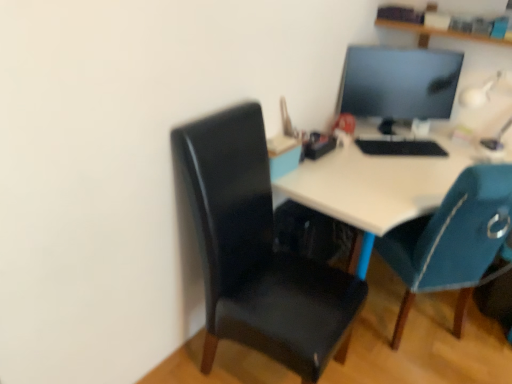
Describe the element at coordinates (258, 253) in the screenshot. I see `glossy black chair at center-left, which is the 2th chair in right-to-left order` at that location.

The width and height of the screenshot is (512, 384). Describe the element at coordinates (452, 240) in the screenshot. I see `teal fabric chair at right, which is the second chair in left-to-right order` at that location.

Locate an element on the screen. The height and width of the screenshot is (384, 512). wooden shelf at upper center is located at coordinates (435, 32).

The image size is (512, 384). I want to click on white glossy desk at center, so (x=379, y=183).

From a real-world perspective, who is located lower, teal fabric chair at right, which is counted as the first chair, starting from the right, or wooden shelf at upper center?

From a 3D spatial view, teal fabric chair at right, which is counted as the first chair, starting from the right, is below.

Would you say teal fabric chair at right, which is the second chair in left-to-right order, is inside or outside wooden shelf at upper center?

teal fabric chair at right, which is the second chair in left-to-right order, exists outside the volume of wooden shelf at upper center.

Looking at this image, is teal fabric chair at right, which is counted as the first chair, starting from the right, placed right next to wooden shelf at upper center?

No, teal fabric chair at right, which is counted as the first chair, starting from the right, is not touching wooden shelf at upper center.

How much distance is there between teal fabric chair at right, which is the second chair in left-to-right order, and wooden shelf at upper center?

teal fabric chair at right, which is the second chair in left-to-right order, is 1.08 meters from wooden shelf at upper center.

Based on the photo, could you measure the distance between teal fabric chair at right, which is counted as the first chair, starting from the right, and white glossy table lamp at upper right?

33.06 inches.

Who is taller, teal fabric chair at right, which is counted as the first chair, starting from the right, or white glossy table lamp at upper right?

With more height is teal fabric chair at right, which is counted as the first chair, starting from the right.

Does teal fabric chair at right, which is counted as the first chair, starting from the right, appear on the right side of white glossy table lamp at upper right?

No.

Locate an element on the screen. table lamp located above the teal fabric chair at right, which is the second chair in left-to-right order (from the image's perspective) is located at coordinates (485, 90).

What are the coordinates of `desk that appears on the right of matte black monitor at upper right` in the screenshot? It's located at (379, 183).

Is white glossy desk at center taller or shorter than matte black monitor at upper right?

In the image, white glossy desk at center appears to be taller than matte black monitor at upper right.

Can you confirm if white glossy desk at center is positioned to the left of matte black monitor at upper right?

No, white glossy desk at center is not to the left of matte black monitor at upper right.

Between white glossy desk at center and matte black monitor at upper right, which one has smaller width?

matte black monitor at upper right.

From the image's perspective, which is below, matte black monitor at upper right or white glossy table lamp at upper right?

white glossy table lamp at upper right, from the image's perspective.

Is matte black monitor at upper right positioned far away from white glossy table lamp at upper right?

No, matte black monitor at upper right is not far from white glossy table lamp at upper right.

Which of these two, matte black monitor at upper right or white glossy table lamp at upper right, stands shorter?

Standing shorter between the two is white glossy table lamp at upper right.

Considering the sizes of objects matte black monitor at upper right and white glossy table lamp at upper right in the image provided, who is thinner, matte black monitor at upper right or white glossy table lamp at upper right?

With smaller width is matte black monitor at upper right.

From a real-world perspective, which object rests below the other?

white glossy table lamp at upper right.

Where is `shelf located in front of the white glossy table lamp at upper right`? Image resolution: width=512 pixels, height=384 pixels. shelf located in front of the white glossy table lamp at upper right is located at coordinates (435, 32).

Is wooden shelf at upper center placed right next to white glossy table lamp at upper right?

wooden shelf at upper center and white glossy table lamp at upper right are clearly separated.

Is point (418, 27) farther from camera compared to point (498, 146)?

That is False.

In terms of size, does white glossy table lamp at upper right appear bigger or smaller than white glossy desk at center?

In the image, white glossy table lamp at upper right appears to be smaller than white glossy desk at center.

In the image, is white glossy table lamp at upper right on the left side or the right side of white glossy desk at center?

Clearly, white glossy table lamp at upper right is on the right of white glossy desk at center in the image.

Is white glossy table lamp at upper right next to white glossy desk at center and touching it?

No, white glossy table lamp at upper right is not touching white glossy desk at center.

Where is `desk above the glossy black chair at center-left, the first chair viewed from the left (from the image's perspective)`? This screenshot has height=384, width=512. desk above the glossy black chair at center-left, the first chair viewed from the left (from the image's perspective) is located at coordinates (379, 183).

From a real-world perspective, relative to glossy black chair at center-left, which is the 2th chair in right-to-left order, is white glossy desk at center vertically above or below?

white glossy desk at center is below glossy black chair at center-left, which is the 2th chair in right-to-left order.

Who is more distant, white glossy desk at center or glossy black chair at center-left, which is the 2th chair in right-to-left order?

Positioned behind is white glossy desk at center.

Is white glossy desk at center aimed at glossy black chair at center-left, which is the 2th chair in right-to-left order?

No.

Locate an element on the screen. This screenshot has width=512, height=384. shelf above the teal fabric chair at right, which is counted as the first chair, starting from the right (from a real-world perspective) is located at coordinates (435, 32).

Which chair is the 1st one when counting from the front of the white glossy table lamp at upper right? Please provide its 2D coordinates.

[(452, 240)]

Looking at the image, which one is located further to white glossy desk at center, glossy black chair at center-left, which is the 2th chair in right-to-left order, or white glossy table lamp at upper right?

white glossy table lamp at upper right lies further to white glossy desk at center than the other object.

From the image, which object appears to be farther from matte black monitor at upper right, white glossy desk at center or teal fabric chair at right, which is counted as the first chair, starting from the right?

The object further to matte black monitor at upper right is teal fabric chair at right, which is counted as the first chair, starting from the right.

From the image, which object appears to be farther from wooden shelf at upper center, white glossy table lamp at upper right or teal fabric chair at right, which is the second chair in left-to-right order?

teal fabric chair at right, which is the second chair in left-to-right order.

Based on their spatial positions, is white glossy table lamp at upper right or glossy black chair at center-left, which is the 2th chair in right-to-left order, further from wooden shelf at upper center?

Among the two, glossy black chair at center-left, which is the 2th chair in right-to-left order, is located further to wooden shelf at upper center.

Estimate the real-world distances between objects in this image. Which object is further from white glossy desk at center, teal fabric chair at right, which is the second chair in left-to-right order, or matte black monitor at upper right?

matte black monitor at upper right lies further to white glossy desk at center than the other object.

When comparing their distances from wooden shelf at upper center, does teal fabric chair at right, which is the second chair in left-to-right order, or glossy black chair at center-left, the first chair viewed from the left, seem further?

glossy black chair at center-left, the first chair viewed from the left, lies further to wooden shelf at upper center than the other object.

Looking at the image, which one is located closer to matte black monitor at upper right, white glossy table lamp at upper right or glossy black chair at center-left, which is the 2th chair in right-to-left order?

white glossy table lamp at upper right lies closer to matte black monitor at upper right than the other object.

When comparing their distances from matte black monitor at upper right, does white glossy desk at center or glossy black chair at center-left, which is the 2th chair in right-to-left order, seem further?

Among the two, glossy black chair at center-left, which is the 2th chair in right-to-left order, is located further to matte black monitor at upper right.

The width and height of the screenshot is (512, 384). In order to click on chair between wooden shelf at upper center and glossy black chair at center-left, the first chair viewed from the left, in the vertical direction in this screenshot , I will do `click(452, 240)`.

You are a GUI agent. You are given a task and a screenshot of the screen. Output one action in this format:
    pyautogui.click(x=<x>, y=<y>)
    Task: Click on the desk between glossy black chair at center-left, which is the 2th chair in right-to-left order, and matte black monitor at upper right from front to back
    The image size is (512, 384).
    Given the screenshot: What is the action you would take?
    pyautogui.click(x=379, y=183)

Identify the location of chair between glossy black chair at center-left, the first chair viewed from the left, and matte black monitor at upper right from front to back. The width and height of the screenshot is (512, 384). (452, 240).

Image resolution: width=512 pixels, height=384 pixels. What are the coordinates of `table lamp between wooden shelf at upper center and teal fabric chair at right, which is counted as the first chair, starting from the right, vertically` in the screenshot? It's located at (485, 90).